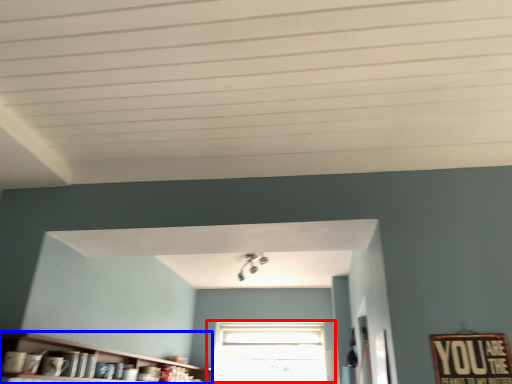
Question: Which point is further to the camera, window (highlighted by a red box) or shelf (highlighted by a blue box)?

Choices:
 (A) window
 (B) shelf

Answer: (A)